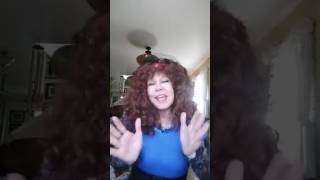
The height and width of the screenshot is (180, 320). What are the coordinates of `ceiling` in the screenshot? It's located at coord(169,23).